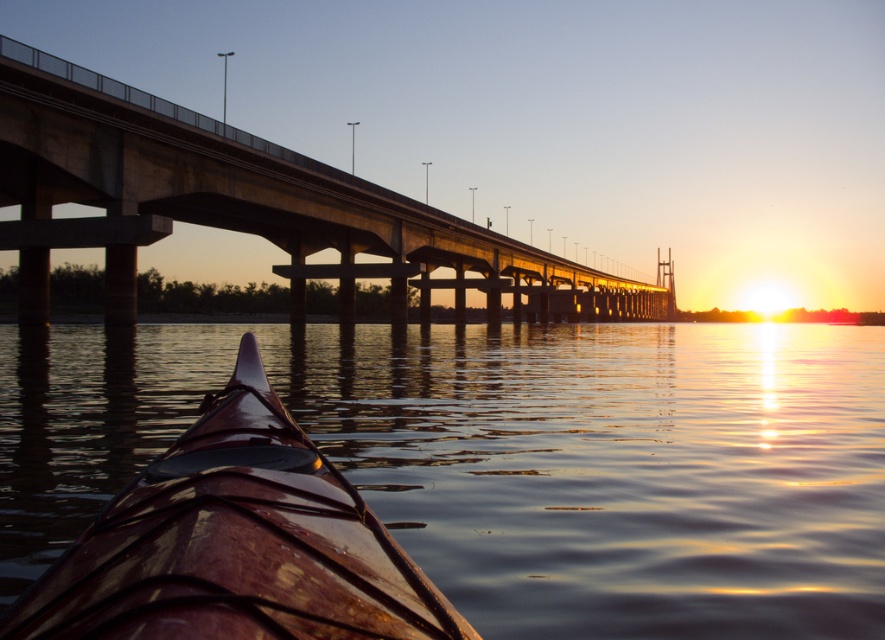
Question: Which point is closer to the camera?

Choices:
 (A) (264, 216)
 (B) (378, 611)

Answer: (B)

Question: Can you confirm if concrete bridge at center is positioned to the right of glossy brown kayak at lower left?

Choices:
 (A) yes
 (B) no

Answer: (A)

Question: Which object appears closest to the camera in this image?

Choices:
 (A) concrete bridge at center
 (B) glossy brown kayak at lower left

Answer: (B)

Question: Which point appears farthest from the camera in this image?

Choices:
 (A) (113, 189)
 (B) (160, 602)

Answer: (A)

Question: Is concrete bridge at center positioned behind glossy brown kayak at lower left?

Choices:
 (A) no
 (B) yes

Answer: (B)

Question: Does concrete bridge at center have a larger size compared to glossy brown kayak at lower left?

Choices:
 (A) no
 (B) yes

Answer: (B)